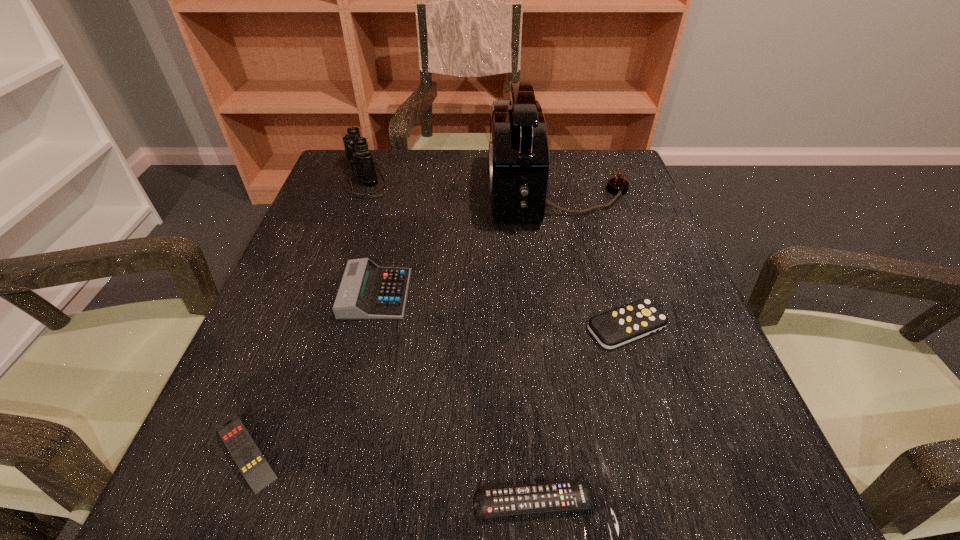
This screenshot has width=960, height=540. Find the location of `vacant space that's between the tallest remote control and the second remote control from left to right`. vacant space that's between the tallest remote control and the second remote control from left to right is located at coordinates (580, 414).

This screenshot has height=540, width=960. Find the location of `free area in between the tallest remote control and the second remote control from left to right`. free area in between the tallest remote control and the second remote control from left to right is located at coordinates (580, 414).

Where is `empty space that is in between the tallest object and the calculator`? empty space that is in between the tallest object and the calculator is located at coordinates (467, 243).

Locate an element on the screen. The width and height of the screenshot is (960, 540). vacant point located between the third shortest object and the calculator is located at coordinates tap(501, 310).

Where is `free space between the leftmost remote control and the third tallest object`? This screenshot has height=540, width=960. free space between the leftmost remote control and the third tallest object is located at coordinates (311, 373).

Identify the location of free space between the second remote control from right to left and the binoculars. The width and height of the screenshot is (960, 540). coord(450,340).

The height and width of the screenshot is (540, 960). I want to click on vacant region between the calculator and the tallest remote control, so click(x=501, y=310).

You are a GUI agent. You are given a task and a screenshot of the screen. Output one action in this format:
    pyautogui.click(x=<x>, y=<y>)
    Task: Click on the free area in between the binoculars and the tallest object
    
    Given the screenshot: What is the action you would take?
    pyautogui.click(x=463, y=184)

Where is `unoccupied area between the tallest object and the leftmost remote control`? The image size is (960, 540). unoccupied area between the tallest object and the leftmost remote control is located at coordinates (401, 321).

Identify the location of vacant area that lies between the second remote control from left to right and the tallest remote control. The height and width of the screenshot is (540, 960). (580, 414).